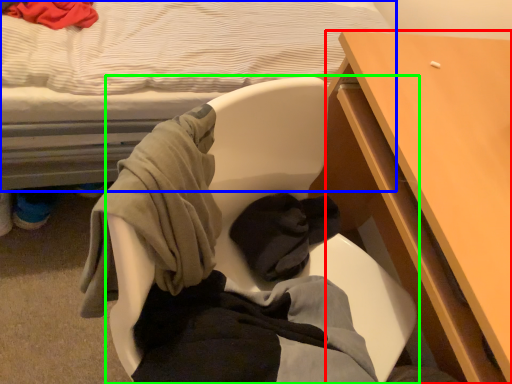
Question: Which is nearer to the desk (highlighted by a red box)? bed (highlighted by a blue box) or chair (highlighted by a green box).

Choices:
 (A) bed
 (B) chair

Answer: (B)